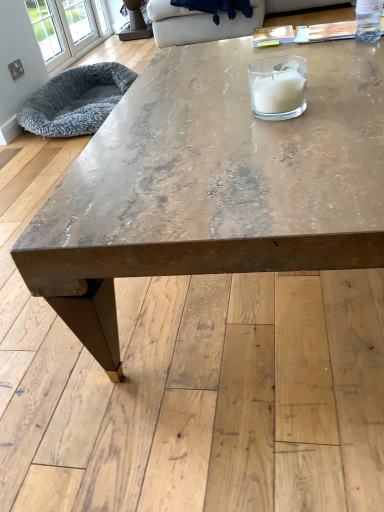
In order to click on space that is in front of white glass candle at upper center in this screenshot , I will do `click(297, 142)`.